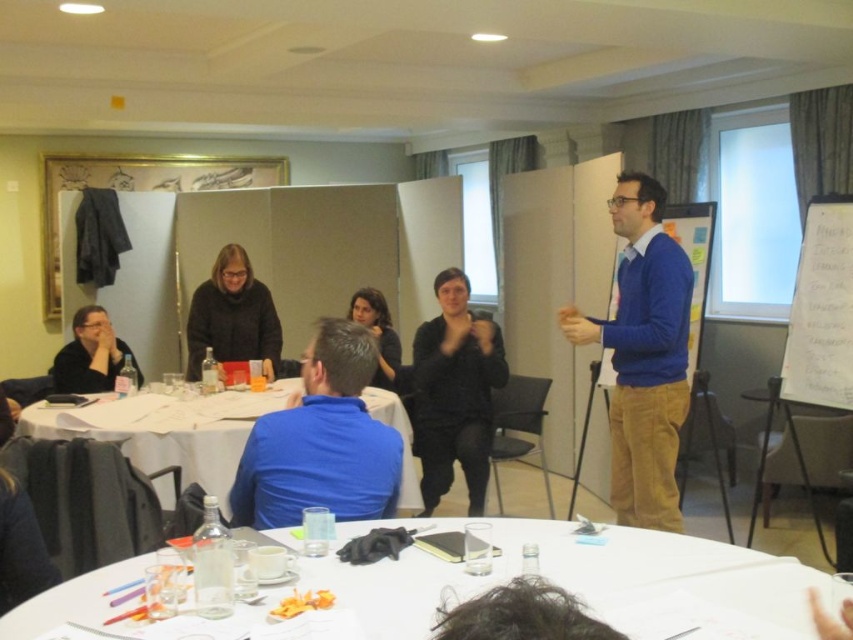
You are a person who is 1.7 meters tall and standing at the camera position. You want to reach the white paper table at center to pick up a pen. Can you comfortably reach it without moving your feet?

The white paper table at center is 2.99 meters away from the camera. Since you are 1.7 meters tall, your arm reach is limited to about 1.5 meters at maximum. Therefore, you cannot comfortably reach the white paper table at center without moving your feet.

You are standing at the entrance of the conference room and want to place a new table at the same position as the white paper table at center. What are the coordinates where you should place the new table?

The coordinates for the white paper table at center are 0.672 in the x direction and 0.198 in the y direction. You should place the new table at point (167, 429).